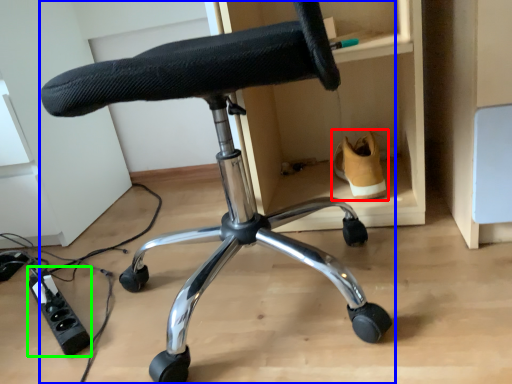
Question: Based on their relative distances, which object is farther from footwear (highlighted by a red box)? Choose from chair (highlighted by a blue box) and plug (highlighted by a green box).

Choices:
 (A) chair
 (B) plug

Answer: (B)